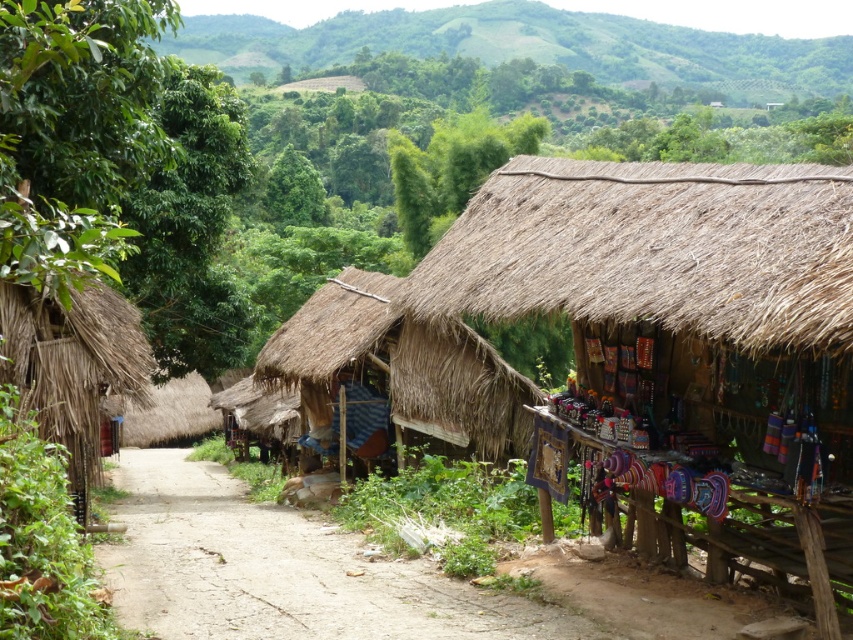
Question: Among these objects, which one is nearest to the camera?

Choices:
 (A) green grassy hillside at upper center
 (B) thatched straw hut at center

Answer: (B)

Question: Which object is closer to the camera taking this photo?

Choices:
 (A) green grassy hillside at upper center
 (B) dirt path at center
 (C) thatched straw hut at center

Answer: (C)

Question: Is dirt path at center positioned before thatched brown hut at center?

Choices:
 (A) yes
 (B) no

Answer: (A)

Question: Does thatched straw hut at center lie in front of thatched straw hut at left?

Choices:
 (A) no
 (B) yes

Answer: (B)

Question: Which is nearer to the green grassy hillside at upper center?

Choices:
 (A) dirt path at center
 (B) thatched straw hut at center

Answer: (A)

Question: Is dirt path at center smaller than green grassy hillside at upper center?

Choices:
 (A) no
 (B) yes

Answer: (B)